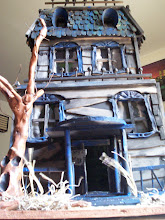
Find the location of a particular element. shutter is located at coordinates (151, 98).